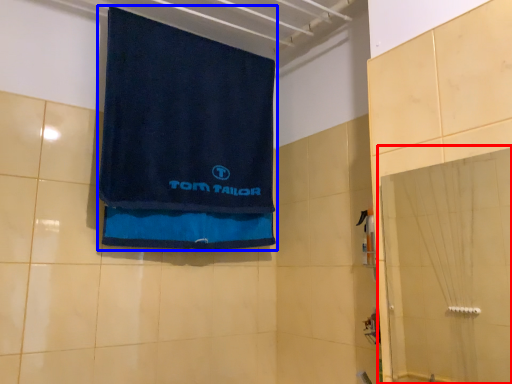
Question: Which point is closer to the camera, glass door (highlighted by a red box) or towel (highlighted by a blue box)?

Choices:
 (A) glass door
 (B) towel

Answer: (A)